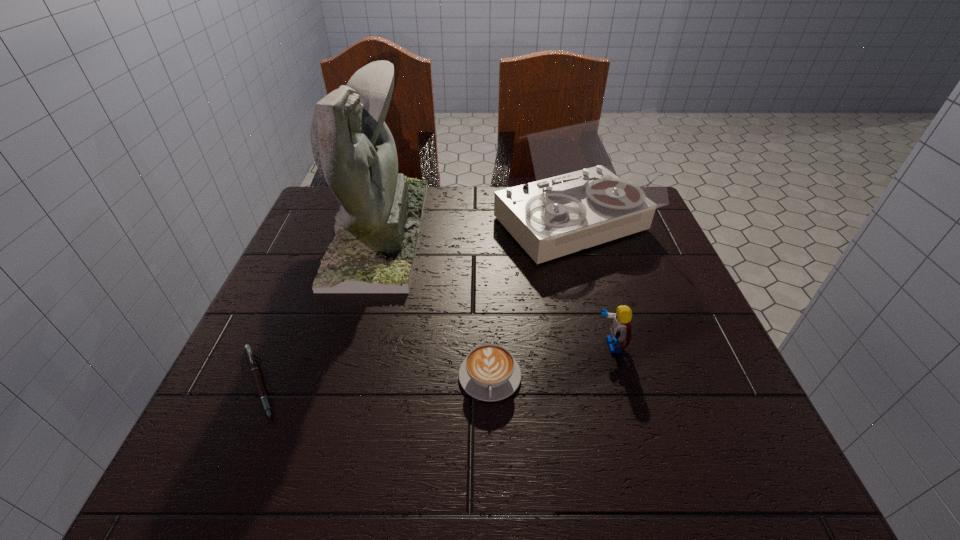
At what (x,y) coordinates should I click in order to perform the action: click on free space at the near edge. Please return your answer as a coordinate pair (x, y). This screenshot has width=960, height=540. Looking at the image, I should click on (374, 437).

You are a GUI agent. You are given a task and a screenshot of the screen. Output one action in this format:
    pyautogui.click(x=<x>, y=<y>)
    Task: Click on the vacant region at the left edge
    
    Given the screenshot: What is the action you would take?
    pyautogui.click(x=276, y=303)

Locate an element on the screen. The image size is (960, 540). vacant space at the right edge is located at coordinates (646, 246).

In the image, there is a desktop. Find the location of `vacant region at the near right corner`. vacant region at the near right corner is located at coordinates (778, 464).

The image size is (960, 540). Identify the location of free space that is in between the tallest object and the cappuccino. (435, 304).

What are the coordinates of `vacant space that's between the fourth tallest object and the record player` in the screenshot? It's located at (532, 302).

The width and height of the screenshot is (960, 540). What are the coordinates of `empty space that is in between the third shortest object and the record player` in the screenshot? It's located at (592, 287).

The image size is (960, 540). What are the coordinates of `free spot between the record player and the third tallest object` in the screenshot? It's located at (592, 287).

The width and height of the screenshot is (960, 540). I want to click on vacant region between the Lego and the second tallest object, so click(592, 287).

I want to click on free space between the second tallest object and the cappuccino, so click(x=532, y=302).